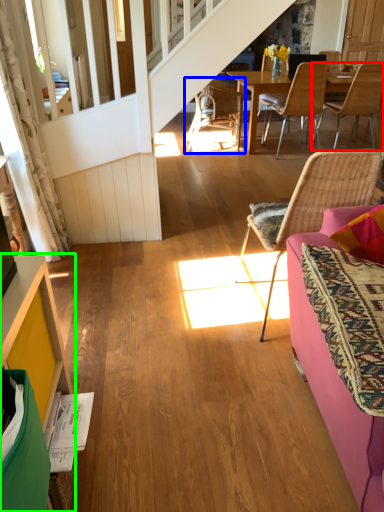
Question: Which object is positioned closest to chair (highlighted by a red box)? Select from chair (highlighted by a blue box) and cabinetry (highlighted by a green box).

Choices:
 (A) chair
 (B) cabinetry

Answer: (A)